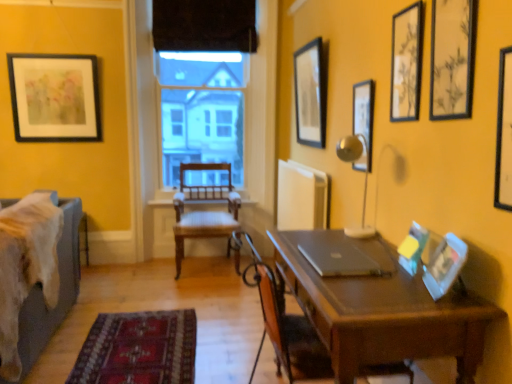
Identify the location of vacant point above matte black picture frame at upper left, the first picture frame positioned from the back (from a real-world perspective). This screenshot has height=384, width=512. (49, 45).